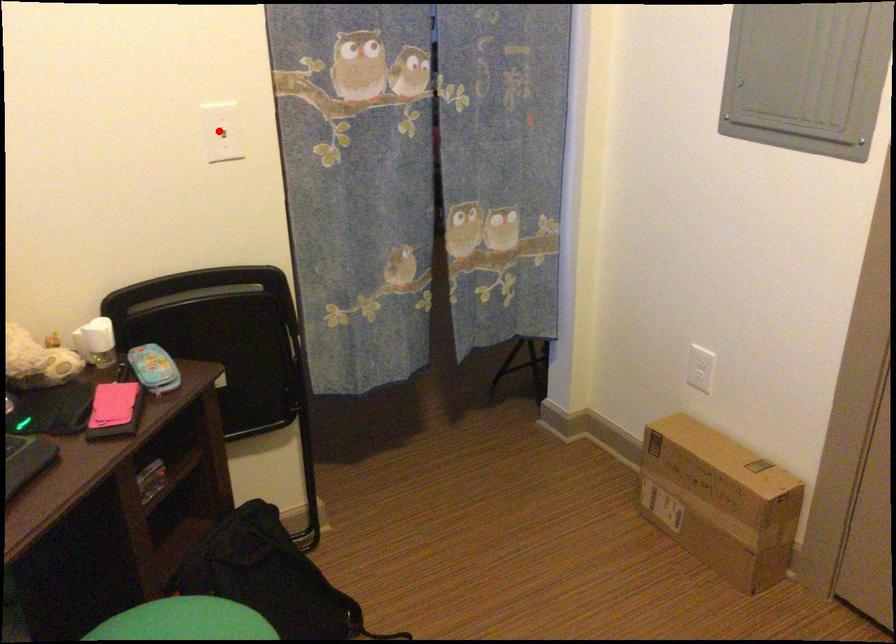
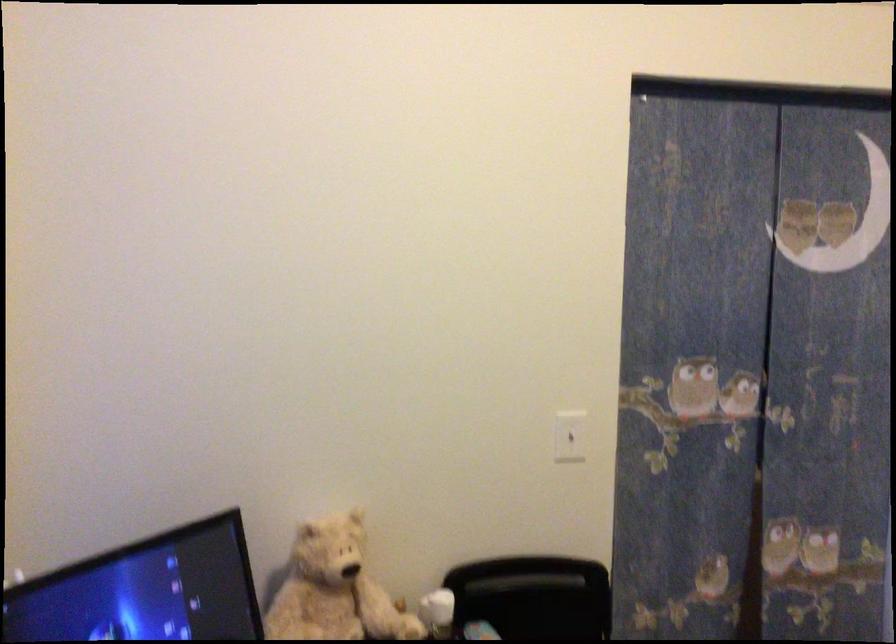
Question: I am providing you with two images of the same scene from different viewpoints. A red point is shown in image1. For the corresponding object point in image2, is it positioned nearer or farther from the camera?

Choices:
 (A) Nearer
 (B) Farther

Answer: (B)